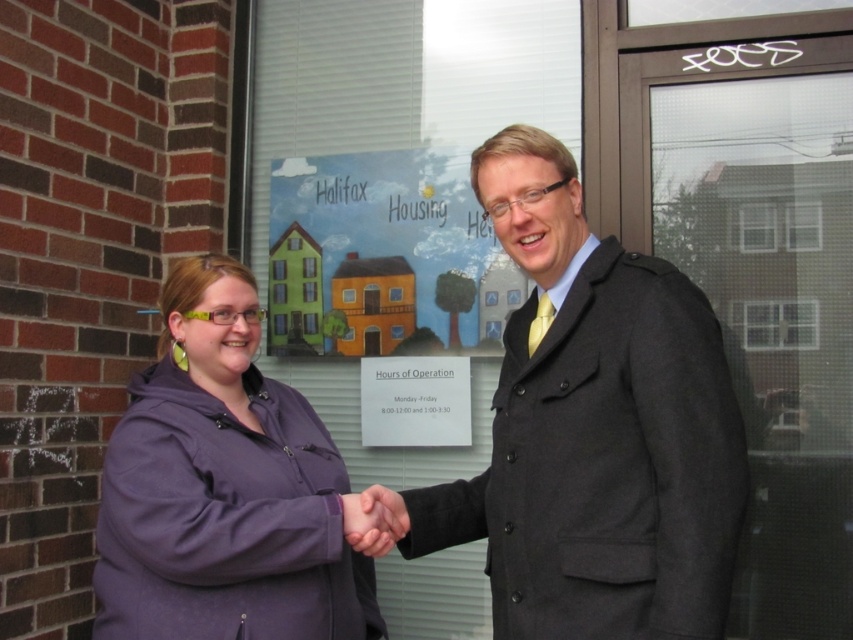
Is point (399, 545) more distant than point (311, 477)?

No, it is in front of (311, 477).

Describe the element at coordinates (593, 429) in the screenshot. I see `dark gray wool coat at center` at that location.

Between point (732, 388) and point (233, 392), which one is positioned behind?

Positioned behind is point (233, 392).

I want to click on dark gray wool coat at center, so click(x=593, y=429).